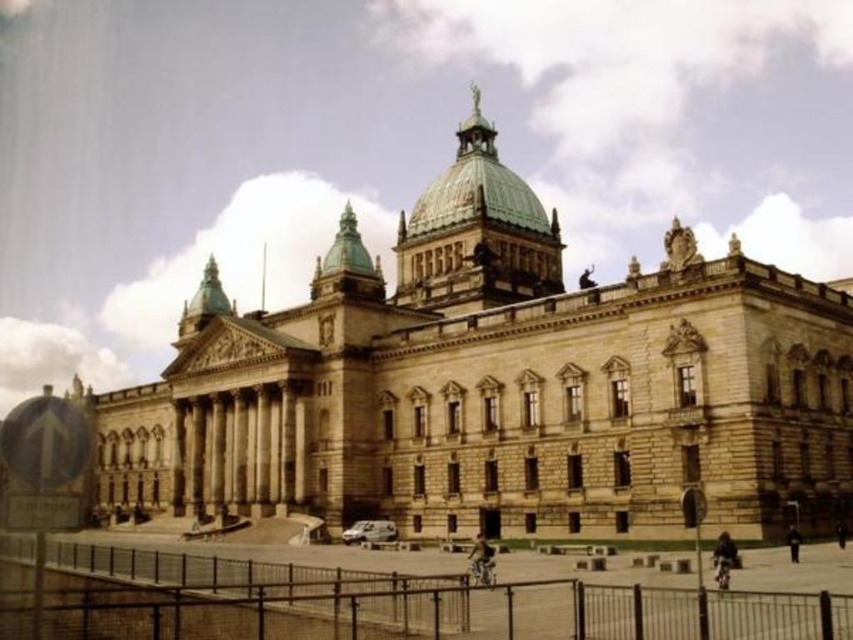
Can you confirm if stone building at center is positioned below metallic chain-link fence at lower center?

Actually, stone building at center is above metallic chain-link fence at lower center.

Does stone building at center have a greater height compared to metallic chain-link fence at lower center?

Indeed, stone building at center has a greater height compared to metallic chain-link fence at lower center.

Who is more forward, (148, 432) or (136, 588)?

Point (136, 588)

This screenshot has height=640, width=853. Identify the location of stone building at center. (497, 385).